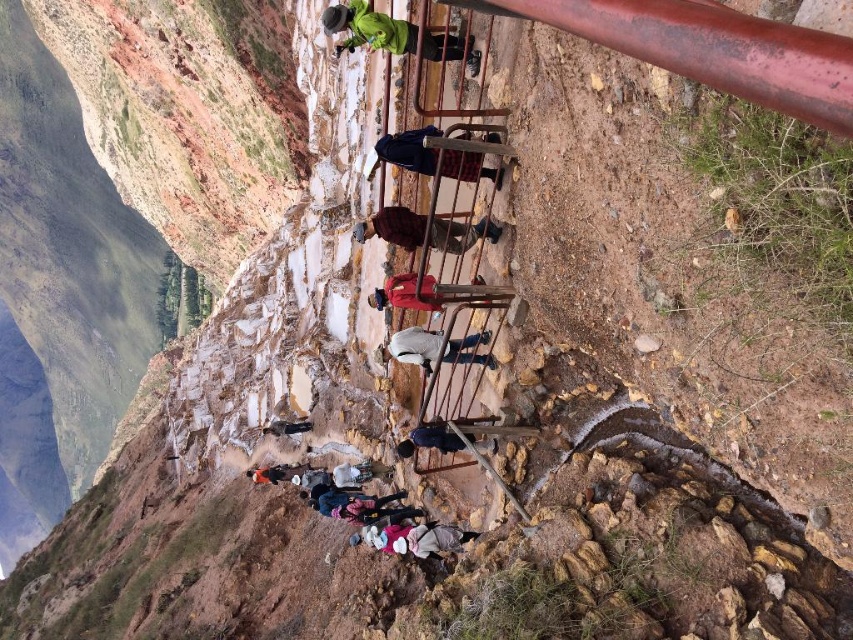
You are standing at the cliffside overlooking the salt pans and notice two points marked in the scene. Which of these points, point (335, 13) or point (305, 426), is closer to your current position?

Point (335, 13) is closer to the camera than point (305, 426), so it is closer to your current position.

You are a photographer trying to capture a shot of the white fabric jacket at center from the cliffside. The cliff is steep and rocky. Can you safely walk towards the jacket without stepping on the salt pans?

The white fabric jacket at center is positioned at point (434, 348), which is likely on stable ground near the metal railing, so yes, you can safely walk towards it without stepping on the salt pans.

You are a photographer trying to capture a photo of the salt pans from the cliffside. You notice the white fabric jacket at center and the orange fabric bag at center in your frame. Which object should you adjust to avoid blocking the view of the salt pans, and why?

You should adjust the white fabric jacket at center because it has a lesser height compared to the orange fabric bag at center, making it more likely to block the view of the salt pans if not moved.